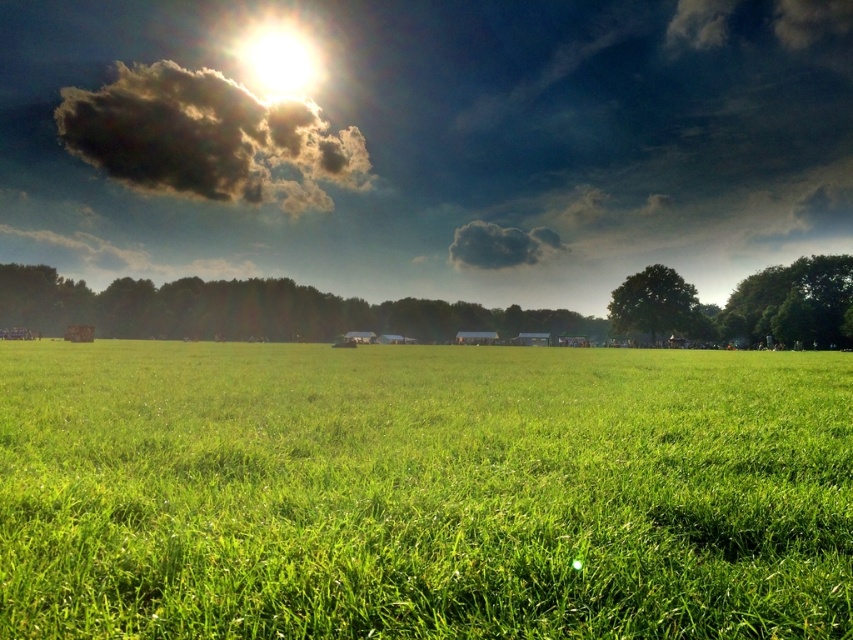
How distant is green grassy pasture at center from dark gray fluffy cloud at upper center?

green grassy pasture at center and dark gray fluffy cloud at upper center are 144.02 meters apart from each other.

Which is more to the right, green grassy pasture at center or dark gray fluffy cloud at upper center?

dark gray fluffy cloud at upper center

Identify the location of green grassy pasture at center. (422, 492).

Between point (62, 88) and point (260, 49), which one is positioned behind?

Point (260, 49)

What do you see at coordinates (207, 138) in the screenshot?
I see `dark fluffy cloud at upper center` at bounding box center [207, 138].

The height and width of the screenshot is (640, 853). I want to click on dark fluffy cloud at upper center, so click(x=207, y=138).

Which of these two, bright sun at upper center or dark gray fluffy cloud at upper center, stands shorter?

With less height is dark gray fluffy cloud at upper center.

Is bright sun at upper center further to the viewer compared to dark gray fluffy cloud at upper center?

Yes, it is behind dark gray fluffy cloud at upper center.

Does point (291, 80) come closer to viewer compared to point (489, 266)?

That is False.

The height and width of the screenshot is (640, 853). I want to click on bright sun at upper center, so click(279, 58).